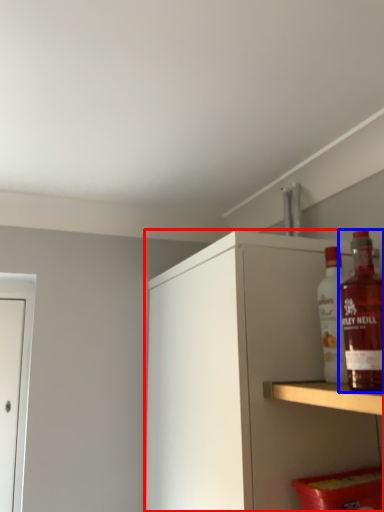
Question: Which object is closer to the camera taking this photo, cabinetry (highlighted by a red box) or bottle (highlighted by a blue box)?

Choices:
 (A) cabinetry
 (B) bottle

Answer: (B)